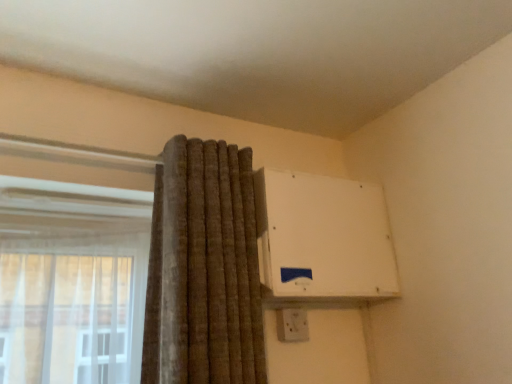
The height and width of the screenshot is (384, 512). What are the coordinates of `white plastic air conditioning unit at upper right` in the screenshot? It's located at (322, 238).

Describe the element at coordinates (322, 238) in the screenshot. The image size is (512, 384). I see `white plastic air conditioning unit at upper right` at that location.

In order to click on white plastic electric outlet at upper right in this screenshot , I will do `click(292, 325)`.

The width and height of the screenshot is (512, 384). What do you see at coordinates (292, 325) in the screenshot?
I see `white plastic electric outlet at upper right` at bounding box center [292, 325].

Identify the location of white plastic air conditioning unit at upper right. This screenshot has height=384, width=512. [322, 238].

Visually, is white plastic electric outlet at upper right positioned to the left or to the right of white plastic air conditioning unit at upper right?

white plastic electric outlet at upper right is to the left of white plastic air conditioning unit at upper right.

Which object is further away from the camera taking this photo, white plastic electric outlet at upper right or white plastic air conditioning unit at upper right?

white plastic electric outlet at upper right.

Is point (290, 320) in front of point (271, 278)?

No, it is not.

From the image's perspective, relative to white plastic air conditioning unit at upper right, is white plastic electric outlet at upper right above or below?

white plastic electric outlet at upper right is below white plastic air conditioning unit at upper right.

From a real-world perspective, which is physically above, white plastic electric outlet at upper right or white plastic air conditioning unit at upper right?

In real-world perspective, white plastic air conditioning unit at upper right is above.

Does white plastic electric outlet at upper right have a lesser width compared to white plastic air conditioning unit at upper right?

Indeed, white plastic electric outlet at upper right has a lesser width compared to white plastic air conditioning unit at upper right.

Between white plastic electric outlet at upper right and white plastic air conditioning unit at upper right, which one has less height?

white plastic electric outlet at upper right is shorter.

From the picture: Is white plastic electric outlet at upper right bigger or smaller than white plastic air conditioning unit at upper right?

white plastic electric outlet at upper right is smaller than white plastic air conditioning unit at upper right.

Would you say white plastic electric outlet at upper right is inside or outside white plastic air conditioning unit at upper right?

The correct answer is: outside.

Are white plastic electric outlet at upper right and white plastic air conditioning unit at upper right making contact?

No.

Could you tell me if white plastic electric outlet at upper right is facing white plastic air conditioning unit at upper right?

No.

Find the location of a particular element. The image size is (512, 384). electric outlet beneath the white plastic air conditioning unit at upper right (from a real-world perspective) is located at coordinates (292, 325).

Between white plastic air conditioning unit at upper right and white plastic electric outlet at upper right, which one appears on the left side from the viewer's perspective?

From the viewer's perspective, white plastic electric outlet at upper right appears more on the left side.

Which object is closer to the camera, white plastic air conditioning unit at upper right or white plastic electric outlet at upper right?

white plastic air conditioning unit at upper right is closer to the camera.

Does point (292, 201) come in front of point (288, 335)?

Yes, point (292, 201) is in front of point (288, 335).

From the image's perspective, is white plastic air conditioning unit at upper right above or below white plastic electric outlet at upper right?

white plastic air conditioning unit at upper right is situated higher than white plastic electric outlet at upper right in the image.

From a real-world perspective, is white plastic air conditioning unit at upper right located higher than white plastic electric outlet at upper right?

Indeed, from a real-world perspective, white plastic air conditioning unit at upper right stands above white plastic electric outlet at upper right.

Can you confirm if white plastic air conditioning unit at upper right is thinner than white plastic electric outlet at upper right?

In fact, white plastic air conditioning unit at upper right might be wider than white plastic electric outlet at upper right.

In terms of height, does white plastic air conditioning unit at upper right look taller or shorter compared to white plastic electric outlet at upper right?

Considering their sizes, white plastic air conditioning unit at upper right has more height than white plastic electric outlet at upper right.

Considering the relative sizes of white plastic air conditioning unit at upper right and white plastic electric outlet at upper right in the image provided, is white plastic air conditioning unit at upper right smaller than white plastic electric outlet at upper right?

No.

Is white plastic air conditioning unit at upper right spatially inside white plastic electric outlet at upper right, or outside of it?

white plastic air conditioning unit at upper right is outside white plastic electric outlet at upper right.

Does white plastic air conditioning unit at upper right touch white plastic electric outlet at upper right?

→ No, white plastic air conditioning unit at upper right is not making contact with white plastic electric outlet at upper right.

Is white plastic air conditioning unit at upper right looking in the opposite direction of white plastic electric outlet at upper right?

white plastic air conditioning unit at upper right is not turned away from white plastic electric outlet at upper right.

The width and height of the screenshot is (512, 384). I want to click on electric outlet behind the white plastic air conditioning unit at upper right, so click(x=292, y=325).

The image size is (512, 384). In the image, there is a white plastic air conditioning unit at upper right. Identify the location of electric outlet below it (from the image's perspective). (292, 325).

Find the location of a particular element. air conditioning on the right of the white plastic electric outlet at upper right is located at coordinates pyautogui.click(x=322, y=238).